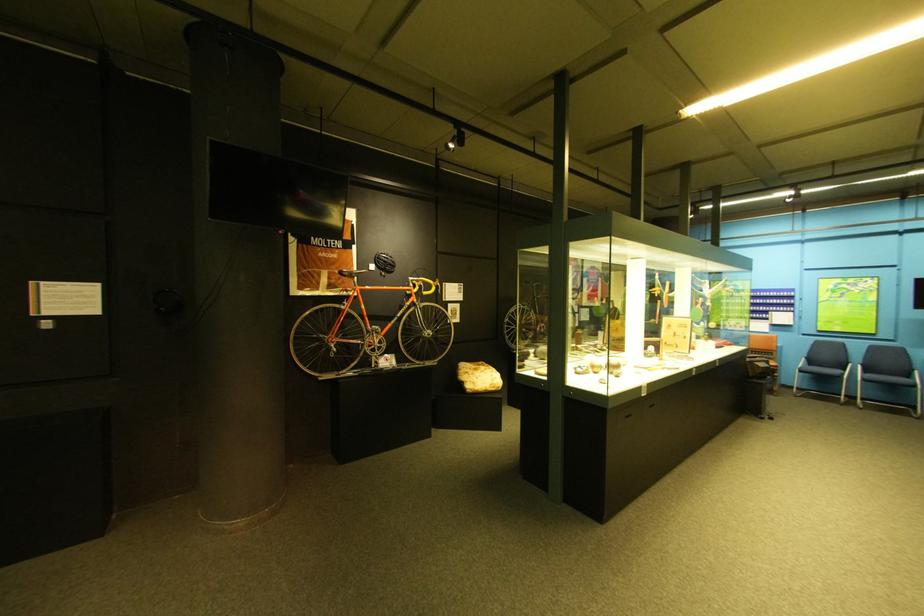
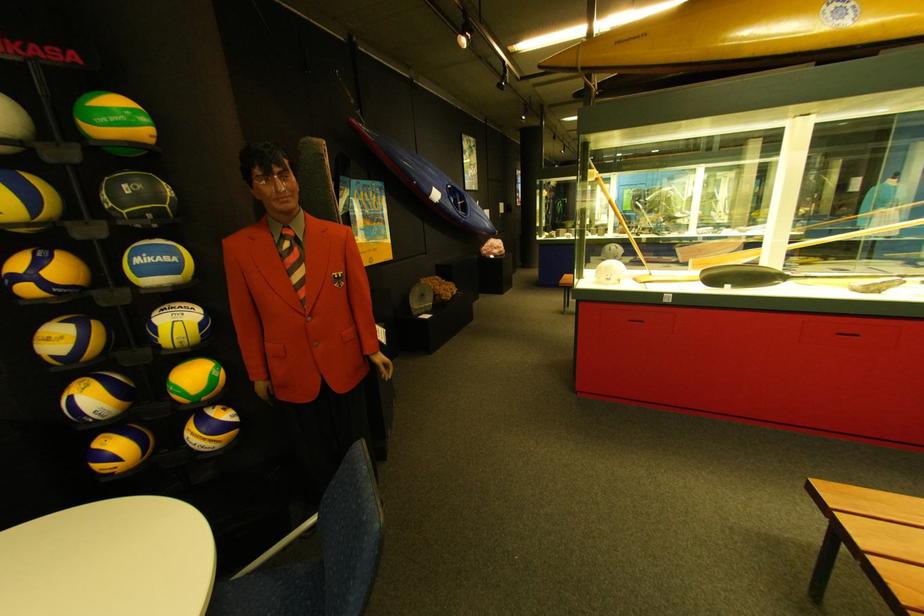
Question: I am providing you with two images of the same scene from different viewpoints. Please identify which objects are invisible in image2.

Choices:
 (A) brown shaker cup
 (B) pink rock specimen
 (C) black bicycle helmet
 (D) red cabinet handle

Answer: (C)